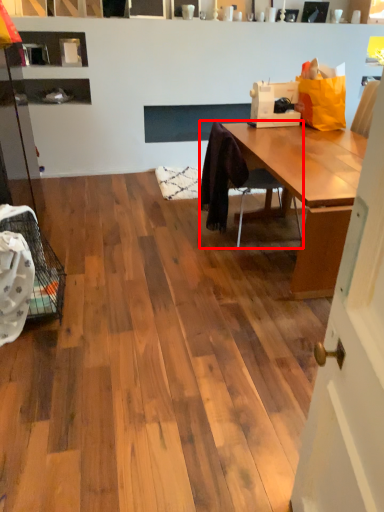
Question: From the image's perspective, where is chair (annotated by the red box) located in relation to sewing machine in the image?

Choices:
 (A) below
 (B) above

Answer: (A)